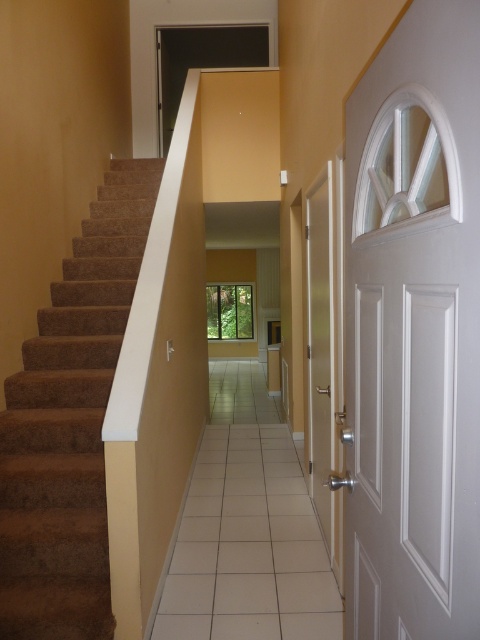
Consider the image. Between brown carpeted stairs at left and white glossy door at center, which one has more height?

With more height is white glossy door at center.

Can you confirm if brown carpeted stairs at left is thinner than white glossy door at center?

No, brown carpeted stairs at left is not thinner than white glossy door at center.

In order to click on brown carpeted stairs at left in this screenshot , I will do `click(70, 422)`.